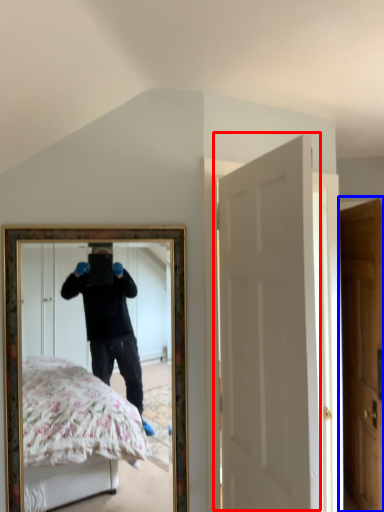
Question: Among these objects, which one is nearest to the camera, door (highlighted by a red box) or door (highlighted by a blue box)?

Choices:
 (A) door
 (B) door

Answer: (A)